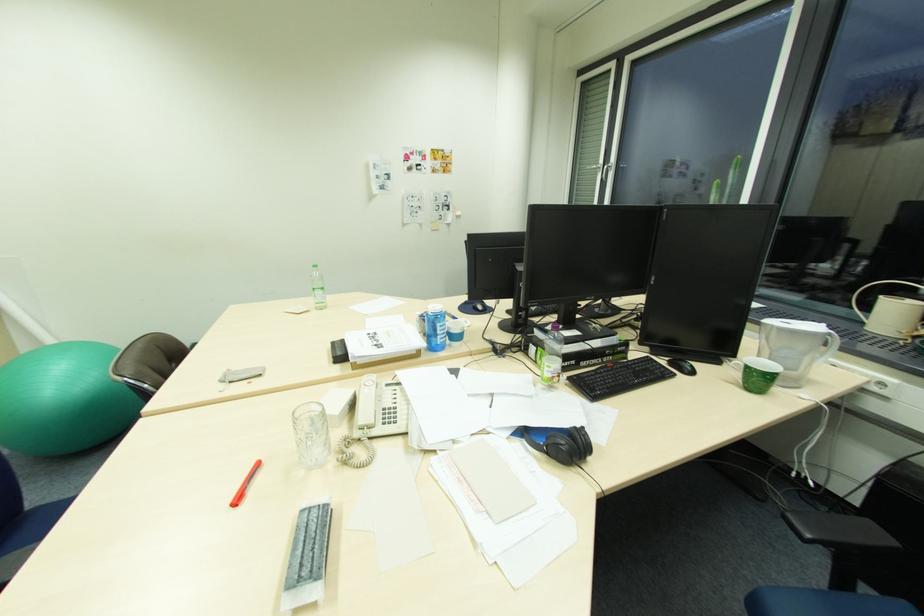
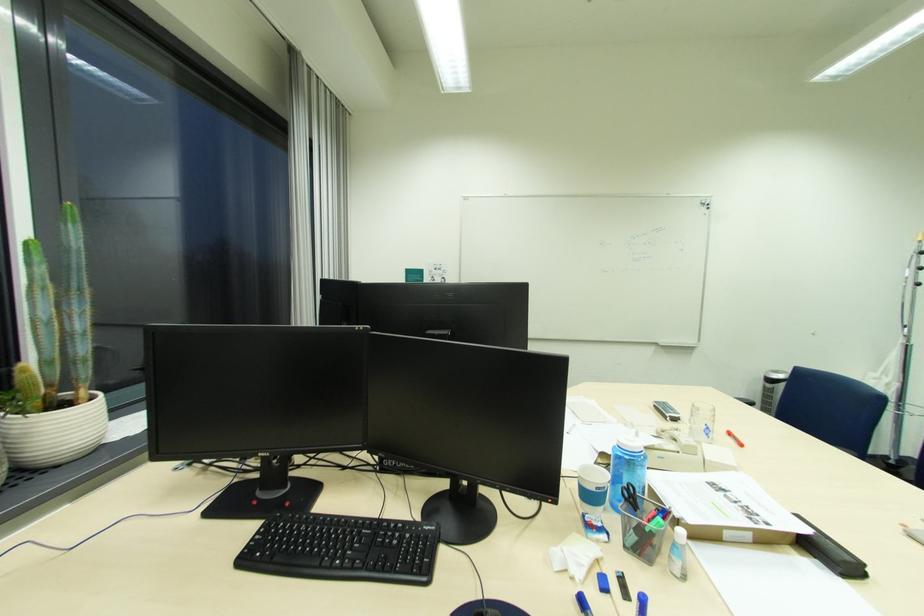
In the second image, find the point that corresponds to point 244,501 in the first image.

(736, 435)